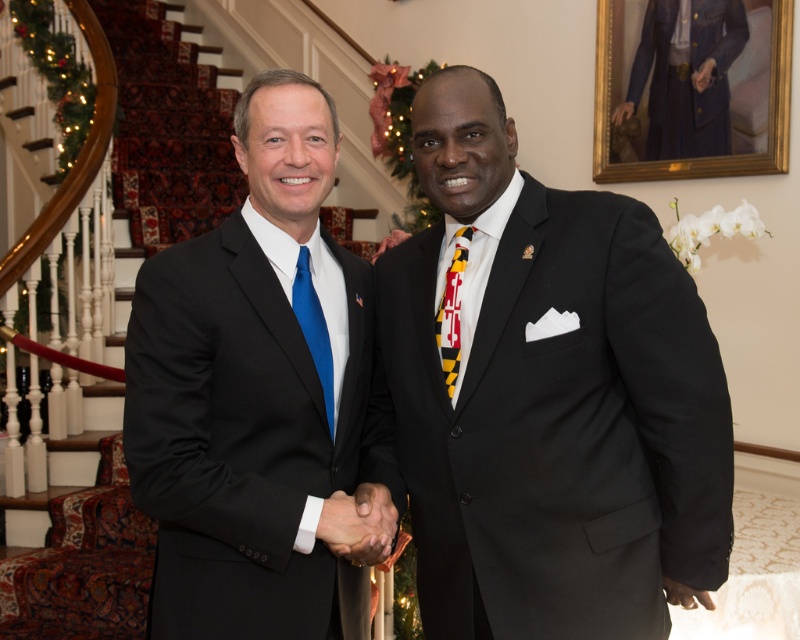
You are a photographer setting up a camera on a tripod. You need to ensure that both the black satin suit at center and the blue silk tie at center are fully visible in the frame. Given that the camera has a fixed focal length, which object should you prioritize positioning closer to the camera to ensure it takes up more of the frame without cropping?

The black satin suit at center is wider than the blue silk tie at center, so positioning the black satin suit at center closer to the camera would ensure it takes up more of the frame without cropping, as wider objects require more space when closer to the camera.